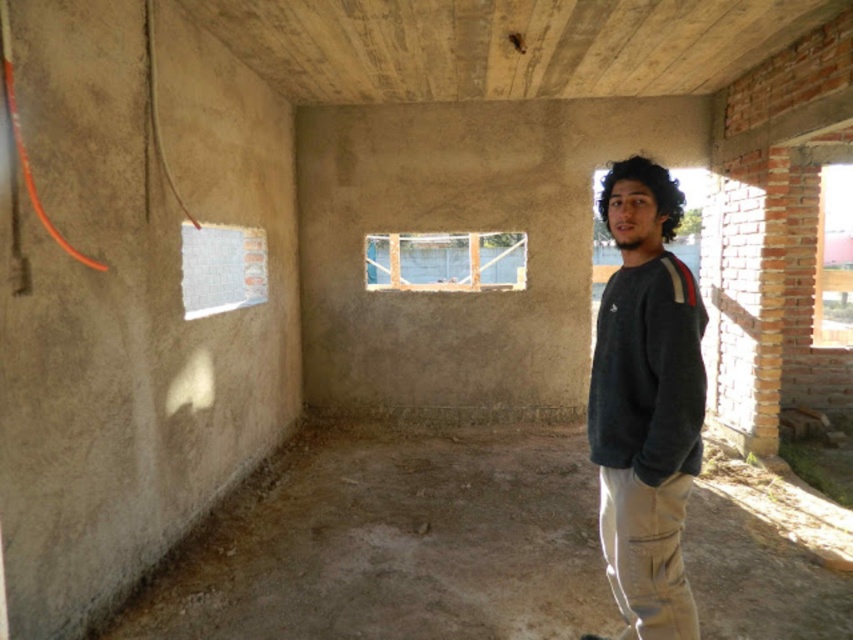
Is the position of dark gray sweater at center more distant than that of dark gray fleece sweatshirt at right?

No, dark gray sweater at center is in front of dark gray fleece sweatshirt at right.

Is point (630, 525) behind point (631, 284)?

No, (630, 525) is closer to viewer.

Identify the location of dark gray sweater at center. (646, 403).

Is dark gray sweater at center thinner than khaki pants at lower right?

No.

The width and height of the screenshot is (853, 640). I want to click on dark gray sweater at center, so click(646, 403).

Measure the distance between dark gray sweater at center and dark curly hair at upper right.

dark gray sweater at center and dark curly hair at upper right are 20.50 inches apart.

Is dark gray sweater at center to the left of dark curly hair at upper right from the viewer's perspective?

Indeed, dark gray sweater at center is positioned on the left side of dark curly hair at upper right.

Who is more distant from viewer, [662,317] or [680,211]?

The point [680,211] is more distant.

This screenshot has height=640, width=853. In order to click on dark gray sweater at center in this screenshot , I will do click(x=646, y=403).